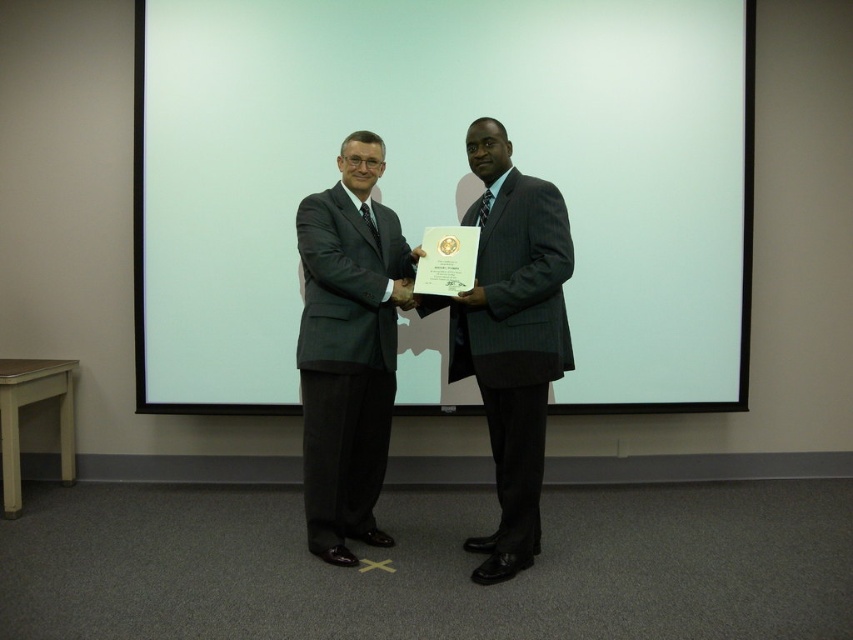
In the scene shown: You are standing in the room where the two men are presenting the certificate. If you want to move directly toward the matte black suit at center, which direction should you walk?

Since the matte black suit at center is located at point 0.545 on the x axis and 0.409 on the y axis, you should walk towards the center of the room to reach it.

You are attending a formal ceremony where a certificate is being presented. You need to find the gray pinstripe suit at center and the white matte screen at center. Based on their positions, which object is closer to the left side of the room?

The white matte screen at center is to the left of the gray pinstripe suit at center, so the white matte screen at center is closer to the left side of the room.